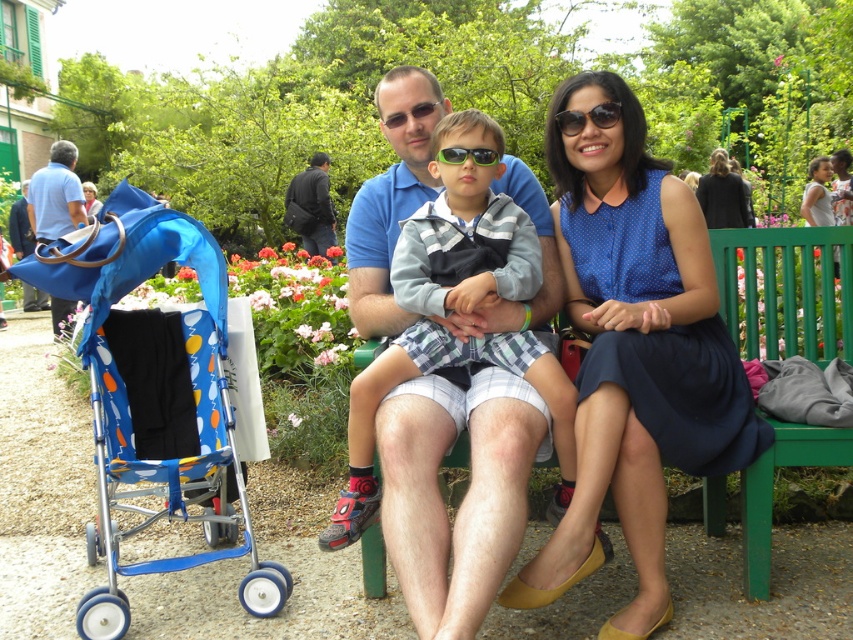
Is blue dotted dress at center positioned at the back of dark blue jacket at center?

That is False.

Who is more distant from viewer, (686,356) or (293,179)?

Point (293,179)

Find the location of a particular element. blue dotted dress at center is located at coordinates pyautogui.click(x=633, y=348).

Between blue cotton shirt at center and blue fabric stroller at left, which one has more height?

Standing taller between the two is blue cotton shirt at center.

Does blue cotton shirt at center have a lesser width compared to blue fabric stroller at left?

Yes, blue cotton shirt at center is thinner than blue fabric stroller at left.

Who is more distant from viewer, (503, 374) or (212, 378)?

The point (212, 378) is behind.

This screenshot has width=853, height=640. In order to click on blue cotton shirt at center in this screenshot , I will do `click(454, 289)`.

Between blue fabric bag at left and dark blue jacket at center, which one has more height?

dark blue jacket at center

Is blue fabric bag at left wider than dark blue jacket at center?

Yes, blue fabric bag at left is wider than dark blue jacket at center.

Does point (47, 211) lie behind point (291, 216)?

No.

Locate an element on the screen. The width and height of the screenshot is (853, 640). blue fabric bag at left is located at coordinates (55, 195).